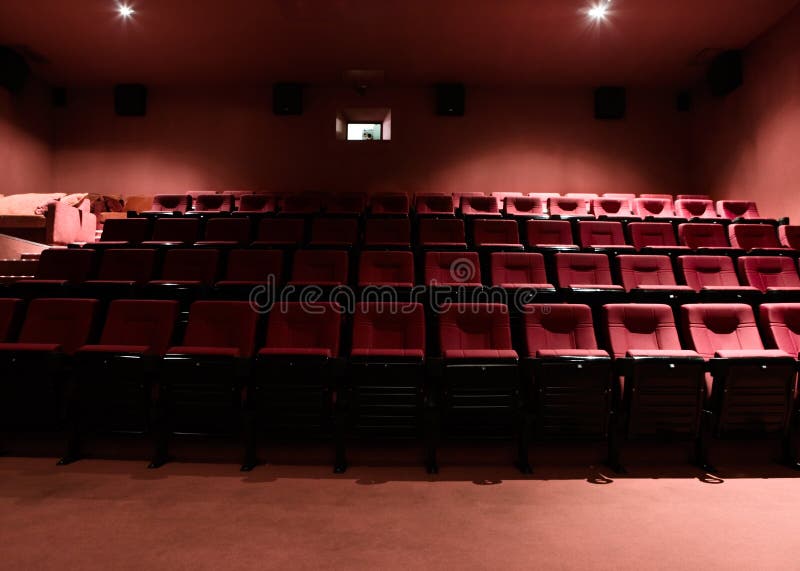
Image resolution: width=800 pixels, height=571 pixels. What are the coordinates of `theatre speakers` in the screenshot? It's located at (718, 82), (608, 107), (456, 102), (288, 99), (134, 99), (17, 72).